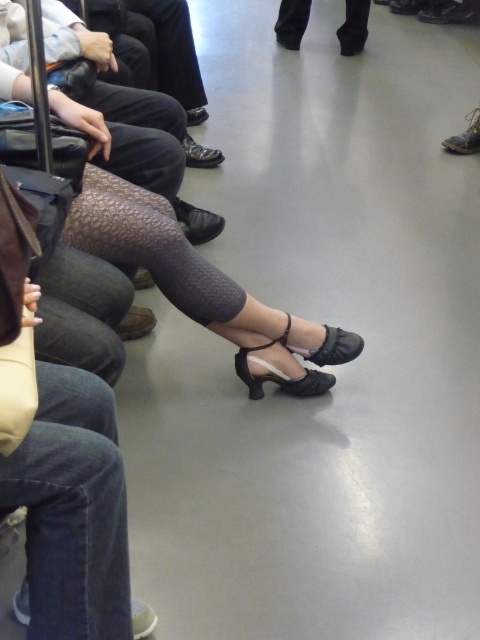
Is point (255, 384) behind point (355, 13)?

No, it is in front of (355, 13).

Between black leather sandal at lower center and black leather shoes at upper center, which one has more height?

With more height is black leather shoes at upper center.

Who is more distant from viewer, (x=277, y=381) or (x=367, y=29)?

The point (x=367, y=29) is more distant.

At what (x,y) coordinates should I click in order to perform the action: click on black leather sandal at lower center. Please return your answer as a coordinate pair (x, y). The height and width of the screenshot is (640, 480). Looking at the image, I should click on (279, 372).

From the picture: Does matte black heels at lower center appear under leather boot at lower right?

Yes, matte black heels at lower center is below leather boot at lower right.

Is point (165, 230) farther from viewer compared to point (478, 113)?

No, it is not.

This screenshot has width=480, height=640. What do you see at coordinates (192, 273) in the screenshot?
I see `matte black heels at lower center` at bounding box center [192, 273].

Identify the location of matte black heels at lower center. (192, 273).

Does point (145, 324) come farther from viewer compared to point (476, 144)?

No.

Who is more forward, (x=139, y=317) or (x=463, y=147)?

Point (x=139, y=317)

Where is `matte black shoe at lower center`? matte black shoe at lower center is located at coordinates (135, 323).